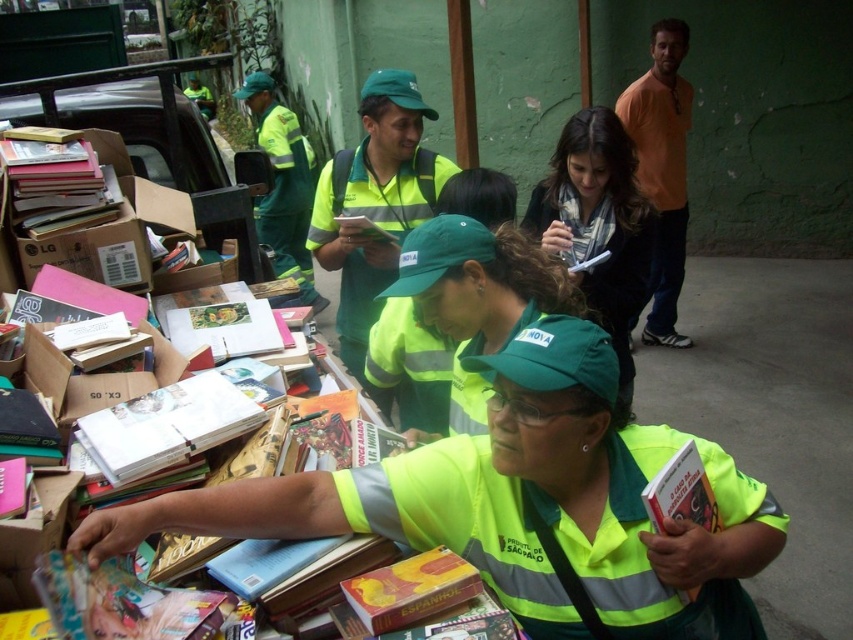
Which is below, orange cotton shirt at upper right or hardcover book at lower center?

Positioned lower is hardcover book at lower center.

Which of these two, orange cotton shirt at upper right or hardcover book at lower center, stands shorter?

With less height is hardcover book at lower center.

You are a GUI agent. You are given a task and a screenshot of the screen. Output one action in this format:
    pyautogui.click(x=<x>, y=<y>)
    Task: Click on the orange cotton shirt at upper right
    The image size is (853, 640).
    Given the screenshot: What is the action you would take?
    pyautogui.click(x=662, y=170)

The width and height of the screenshot is (853, 640). Describe the element at coordinates (520, 506) in the screenshot. I see `green reflective vest at center` at that location.

Is green reflective vest at center above matte green scarf at center?

No, green reflective vest at center is not above matte green scarf at center.

Who is more distant from viewer, (360,476) or (558,221)?

Positioned behind is point (558,221).

This screenshot has width=853, height=640. I want to click on green reflective vest at center, so click(520, 506).

Is green reflective vest at center wider than yellow paper book at center?

Yes.

Can you confirm if green reflective vest at center is positioned to the right of yellow paper book at center?

Correct, you'll find green reflective vest at center to the right of yellow paper book at center.

Locate an element on the screen. Image resolution: width=853 pixels, height=640 pixels. green reflective vest at center is located at coordinates coord(520,506).